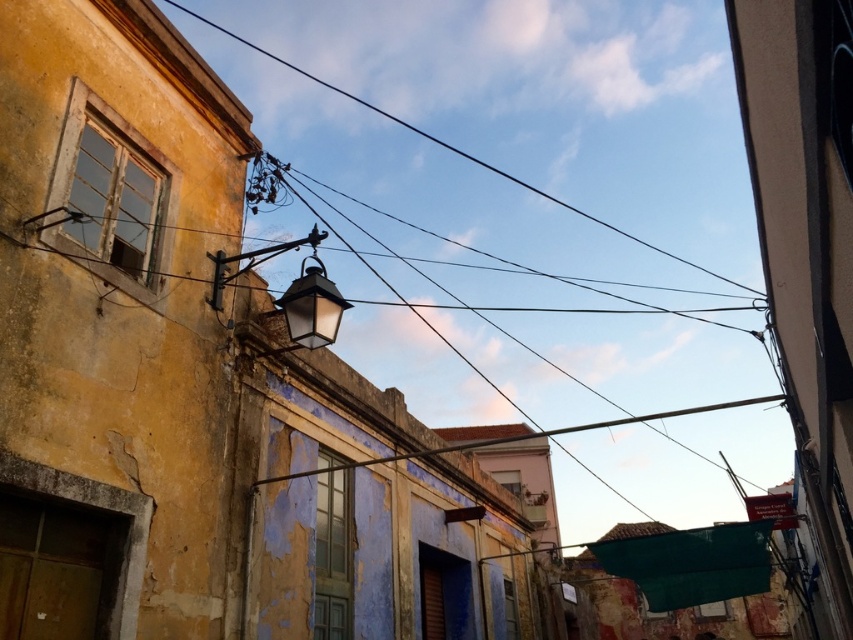
Question: Is black wire at upper center smaller than matte black lantern at center?

Choices:
 (A) no
 (B) yes

Answer: (A)

Question: Which of the following is the closest to the observer?

Choices:
 (A) matte black lantern at center
 (B) black wire at upper center

Answer: (A)

Question: Where is black wire at upper center located in relation to matte black lantern at center in the image?

Choices:
 (A) right
 (B) left

Answer: (A)

Question: Which of the following is the farthest from the observer?

Choices:
 (A) matte black lantern at center
 (B) black wire at upper center

Answer: (B)

Question: Does black wire at upper center appear under matte black lantern at center?

Choices:
 (A) no
 (B) yes

Answer: (A)